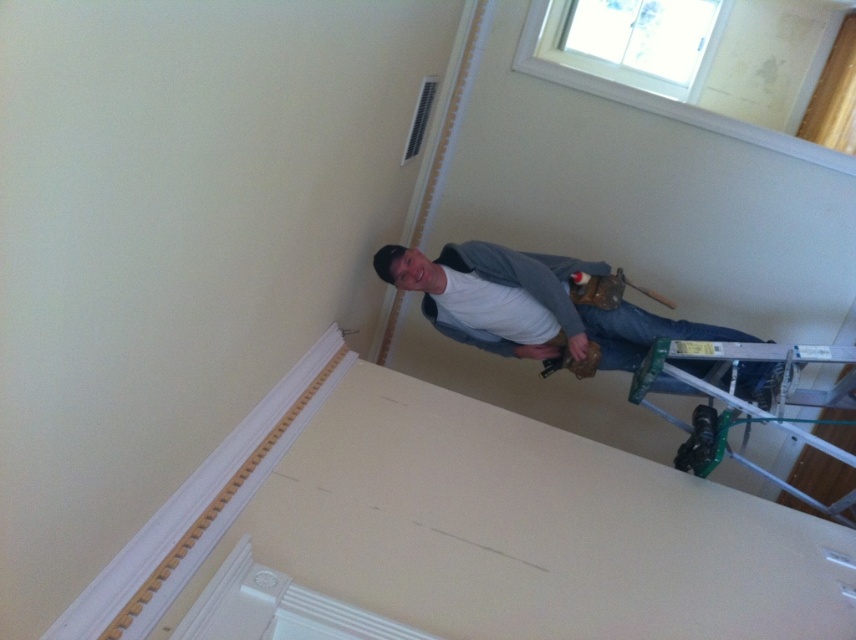
Consider the image. Can you confirm if gray fabric shirt at upper right is positioned to the right of silver metallic ladder at lower right?

Incorrect, gray fabric shirt at upper right is not on the right side of silver metallic ladder at lower right.

Can you confirm if gray fabric shirt at upper right is positioned to the left of silver metallic ladder at lower right?

Indeed, gray fabric shirt at upper right is positioned on the left side of silver metallic ladder at lower right.

Is point (693, 323) more distant than point (694, 419)?

Yes.

Image resolution: width=856 pixels, height=640 pixels. What are the coordinates of `gray fabric shirt at upper right` in the screenshot? It's located at (531, 307).